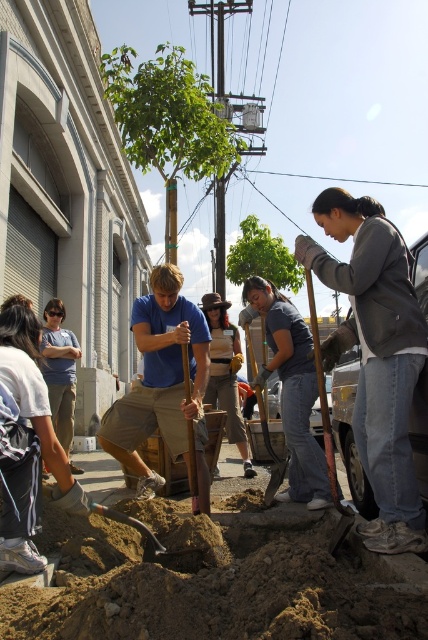
Question: Does gray cotton jacket at center have a greater width compared to wooden shovel at lower right?

Choices:
 (A) no
 (B) yes

Answer: (B)

Question: Which of these objects is positioned farthest from the brown leather hat at center?

Choices:
 (A) denim jeans at center
 (B) green leafy tree at upper center

Answer: (B)

Question: Is blue cotton shirt at center further to camera compared to green leafy tree at center?

Choices:
 (A) yes
 (B) no

Answer: (B)

Question: Which point is farther from the camera taking this photo?

Choices:
 (A) (74, 339)
 (B) (345, 516)
 (C) (214, 310)
 (D) (226, 273)

Answer: (D)

Question: Does denim jeans at center have a smaller size compared to brown leather hat at center?

Choices:
 (A) no
 (B) yes

Answer: (A)

Question: Considering the real-world distances, which object is closest to the green leafy tree at center?

Choices:
 (A) wooden shovel at lower right
 (B) green leafy tree at upper center
 (C) denim jeans at center
 (D) brown sandy soil at lower center

Answer: (B)